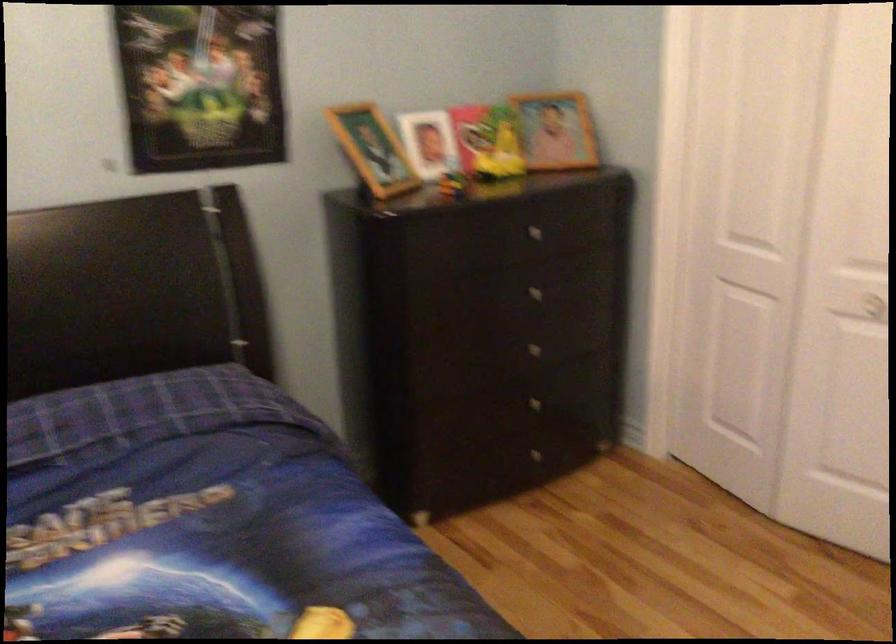
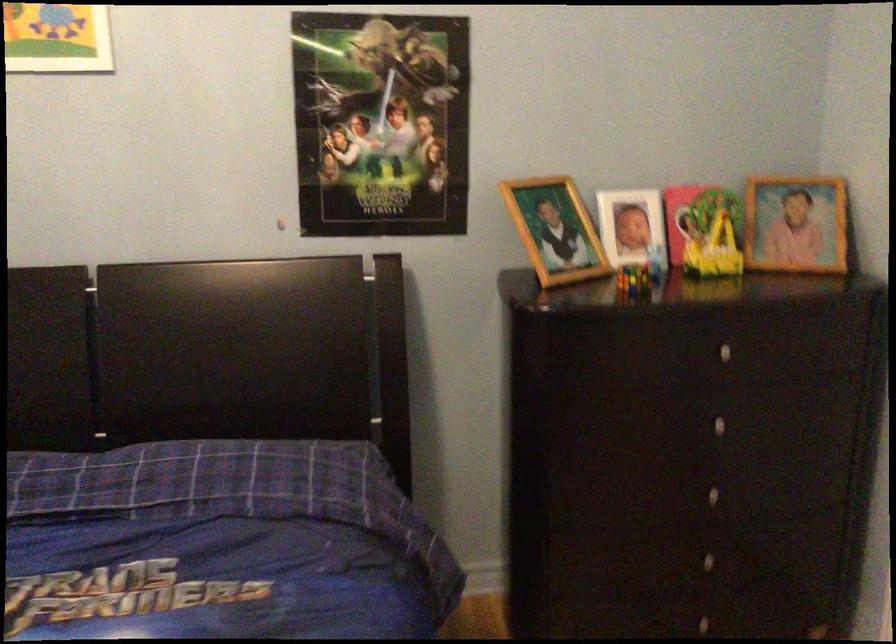
Question: How did the camera likely rotate?

Choices:
 (A) Left
 (B) Right
 (C) Up
 (D) Down

Answer: (A)